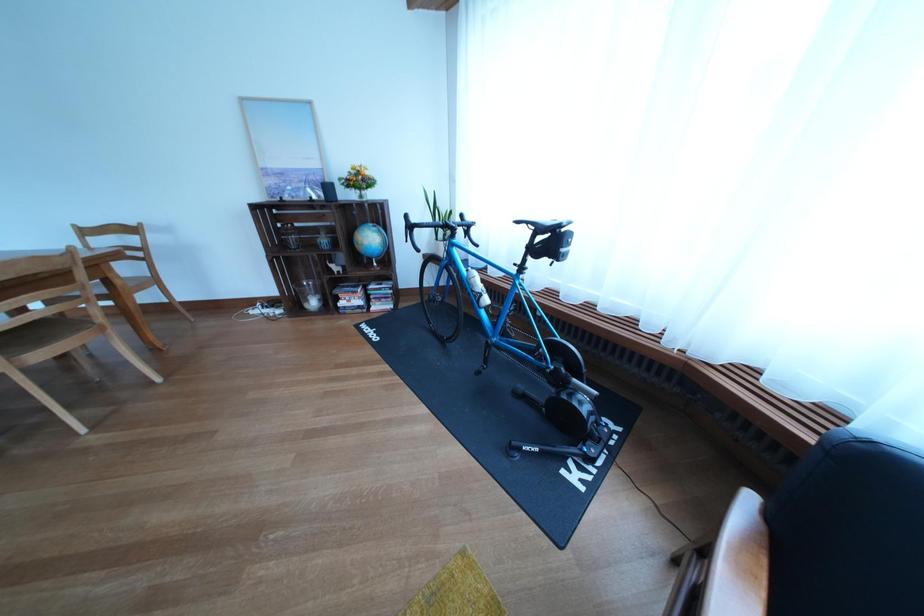
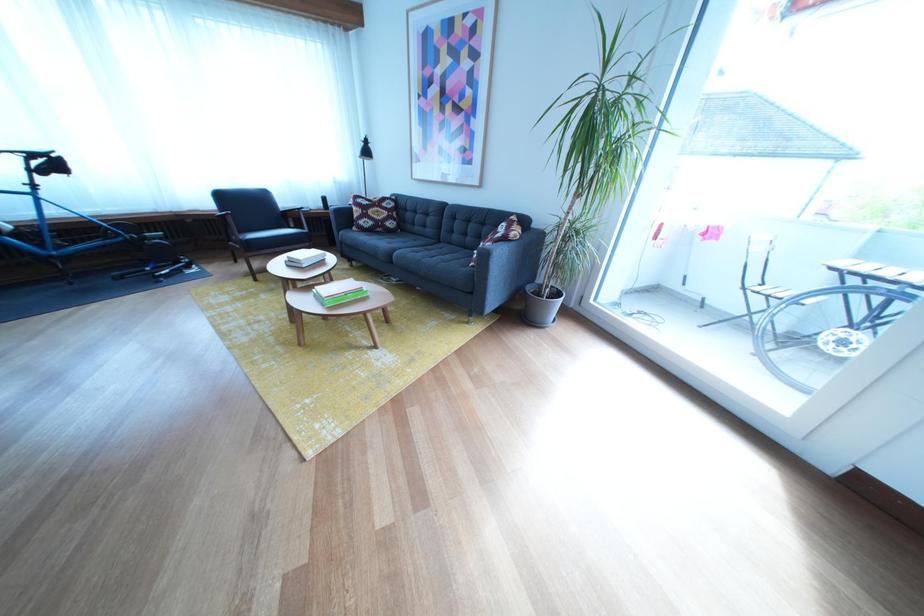
Find the pixel in the second image that matches point (563, 248) in the first image.

(64, 169)